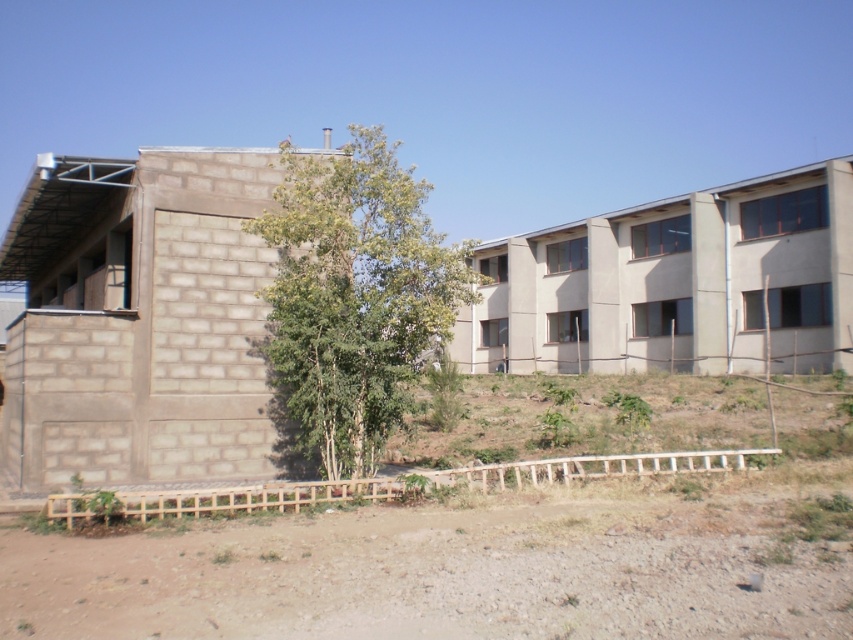
Between brown dirt field at lower center and green leafy tree at center, which one appears on the left side from the viewer's perspective?

From the viewer's perspective, green leafy tree at center appears more on the left side.

Is brown dirt field at lower center to the right of green leafy tree at center from the viewer's perspective?

Indeed, brown dirt field at lower center is positioned on the right side of green leafy tree at center.

Image resolution: width=853 pixels, height=640 pixels. What are the coordinates of `brown dirt field at lower center` in the screenshot? It's located at (474, 560).